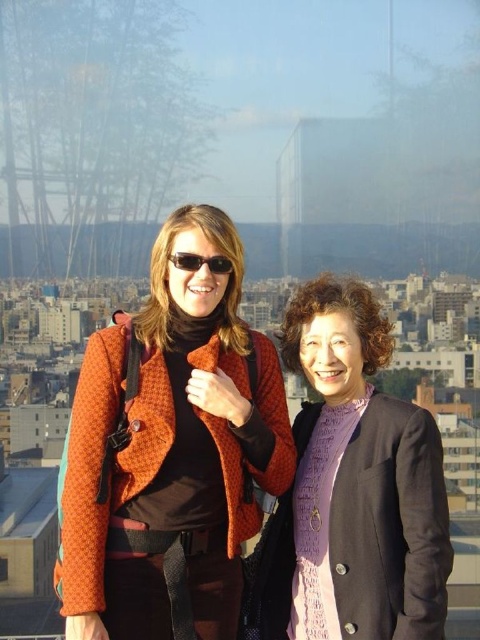
You are a photographer trying to capture a clear shot of the cityscape through the reflective glass. The orange textured jacket at left and the matte black sunglasses at center are in the way. Which object should you move to get a better view of the background?

You should move the orange textured jacket at left because it is positioned under the matte black sunglasses at center, meaning it is closer to the camera and blocking more of the view.